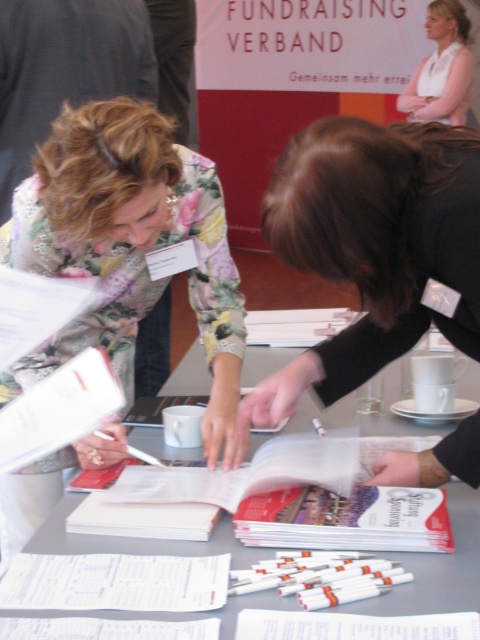
Can you confirm if black matte book at center is shorter than gray paper at center?

Incorrect, black matte book at center's height does not fall short of gray paper at center's.

Between black matte book at center and gray paper at center, which one is positioned lower?

gray paper at center

Measure the distance between black matte book at center and camera.

black matte book at center is 34.39 inches from camera.

At what (x,y) coordinates should I click in order to perform the action: click on black matte book at center. Please return your answer as a coordinate pair (x, y). Image resolution: width=480 pixels, height=640 pixels. Looking at the image, I should click on (372, 246).

Between floral fabric dress at center and black matte book at center, which one is positioned higher?

black matte book at center is higher up.

Is floral fabric dress at center thinner than black matte book at center?

No, floral fabric dress at center is not thinner than black matte book at center.

Which is in front, point (215, 401) or point (383, 157)?

Point (383, 157) is more forward.

Identify the location of floral fabric dress at center. pyautogui.click(x=128, y=244).

Which of these two, floral fabric dress at center or white smooth shirt at upper right, stands shorter?

With less height is white smooth shirt at upper right.

Who is more distant from viewer, (218,250) or (456,93)?

The point (456,93) is more distant.

Is point (227, 246) in front of point (454, 4)?

Yes, point (227, 246) is in front of point (454, 4).

Identify the location of floral fabric dress at center. (128, 244).